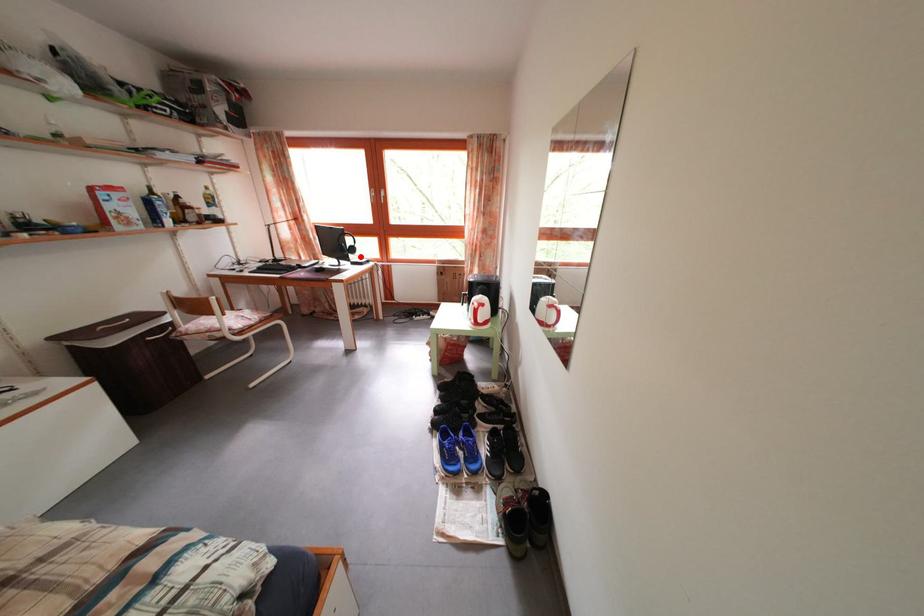
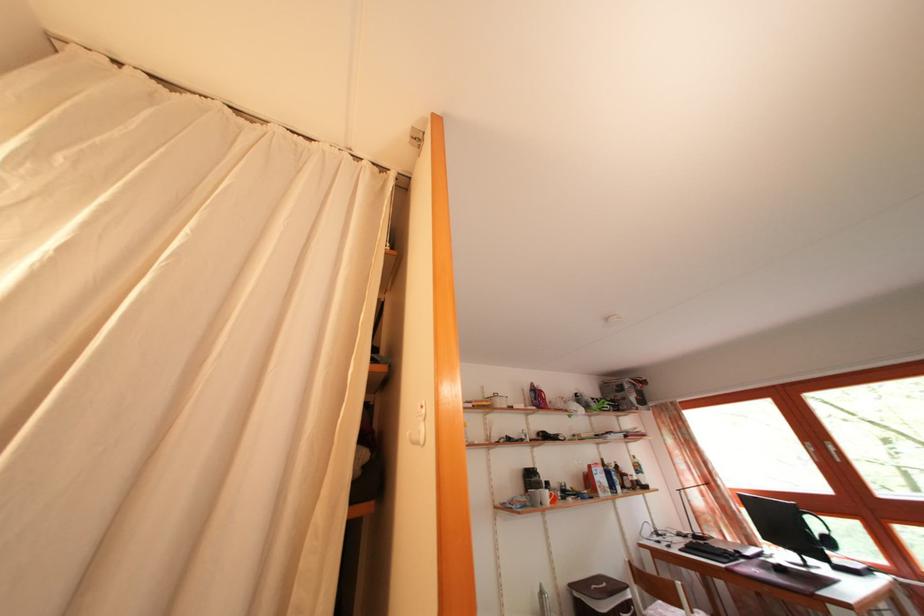
Question: I am providing you with two images of the same scene from different viewpoints. Given a red point in image1, look at the same physical point in image2. Is it:

Choices:
 (A) Closer to the viewpoint
 (B) Farther from the viewpoint

Answer: (A)